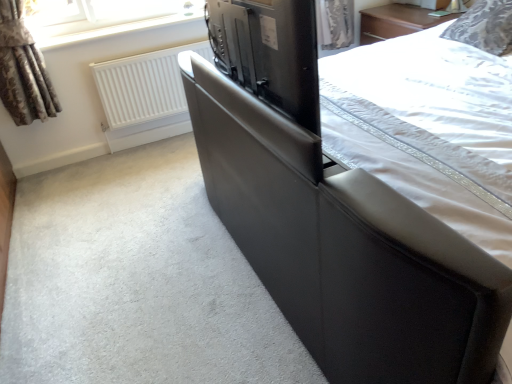
You are a GUI agent. You are given a task and a screenshot of the screen. Output one action in this format:
    pyautogui.click(x=<x>, y=<y>)
    Task: Click on the empty space that is ontop of white matte radiator at upper left (from a real-world perspective)
    The image size is (512, 384).
    Given the screenshot: What is the action you would take?
    click(x=150, y=53)